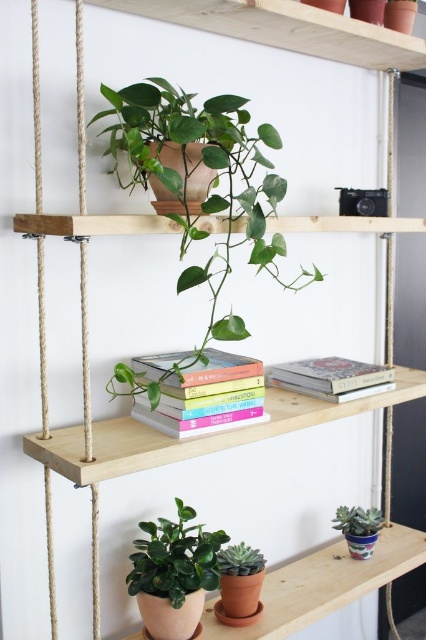
You are standing in front of the wooden shelving unit and want to place a small decorative item exactly at the point marked as point (247, 556). Can you estimate how far you need to reach to place it there?

The point (247, 556) is 4.14 feet from the camera, so you need to reach approximately 4.14 feet to place the item there.

You are a gardener who wants to place a new 30 cm wide decorative item between the green matte succulent at lower center and the green matte succulent at lower right. Based on the spacing between them, will the item fit without overlapping either succulent?

The distance between the green matte succulent at lower center and the green matte succulent at lower right is 34.78 centimeters. Since the decorative item is 30 cm wide, there is enough space between them to fit it without overlapping either succulent.

You are standing in front of the wooden shelving unit. You need to place a new book on the middle shelf where the stack of books is. However, you want to ensure that the new book won not block the view of the green matte plant at center. Can you do this?

The green matte plant at center is positioned at point (206, 193). Since the stack of books is on the middle shelf and the plant is on the top shelf, placing the new book on the middle shelf would not block the view of the plant as they are on different shelves.